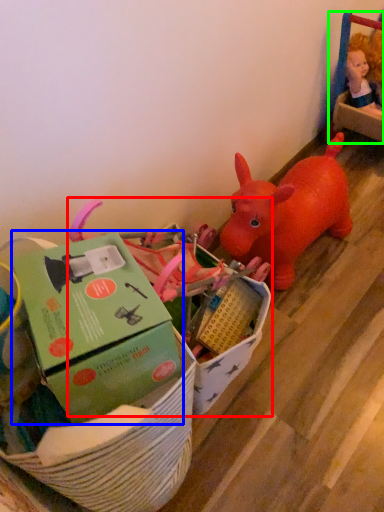
Question: Based on their relative distances, which object is nearer to toy (highlighted by a red box)? Choose from box (highlighted by a blue box) and toy (highlighted by a green box).

Choices:
 (A) box
 (B) toy

Answer: (A)